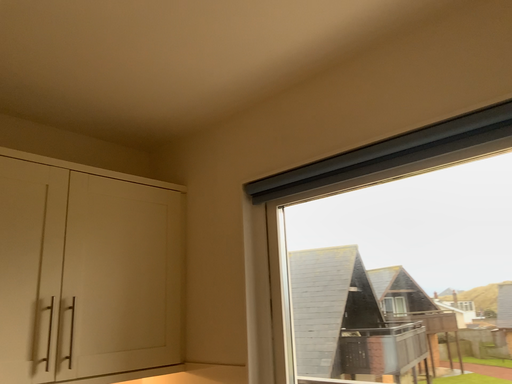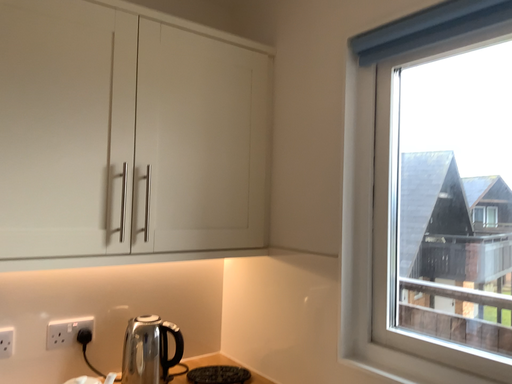
Question: Which way did the camera rotate in the video?

Choices:
 (A) rotated right
 (B) rotated left

Answer: (B)